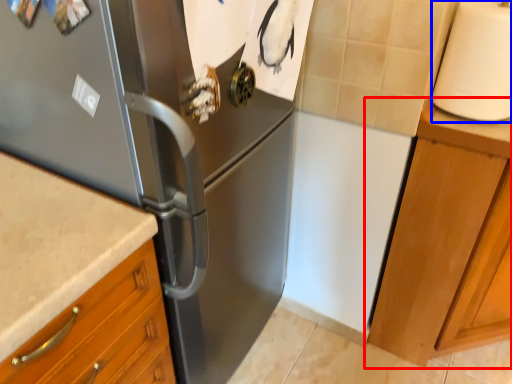
Question: Among these objects, which one is nearest to the camera, cabinetry (highlighted by a red box) or paper towel (highlighted by a blue box)?

Choices:
 (A) cabinetry
 (B) paper towel

Answer: (B)